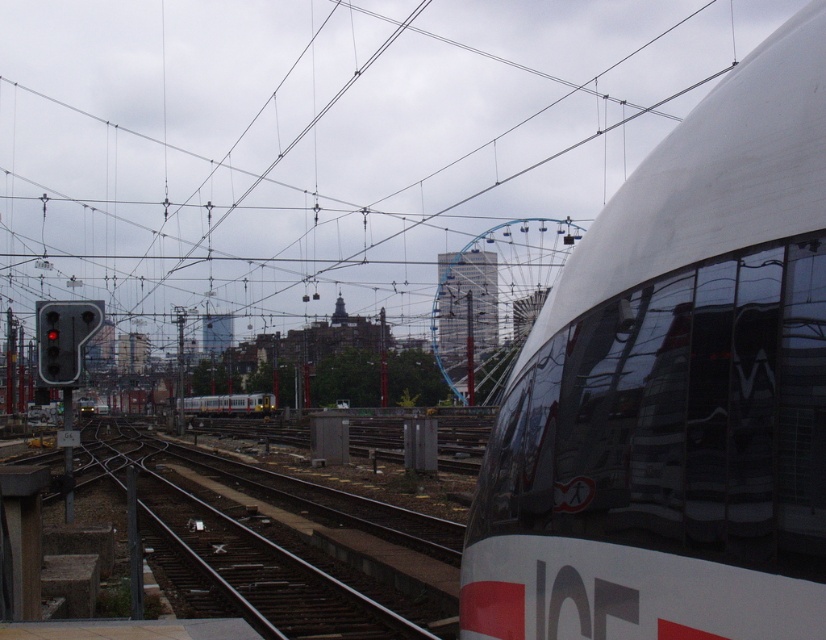
Question: Which of the following is the farthest from the observer?

Choices:
 (A) (397, 230)
 (B) (78, 371)
 (C) (819, 497)

Answer: (A)

Question: Can you confirm if white glossy train at center is wider than silver metallic train at center?

Choices:
 (A) yes
 (B) no

Answer: (B)

Question: Can you confirm if white glossy train at center is positioned below black plastic traffic light at left?

Choices:
 (A) yes
 (B) no

Answer: (B)

Question: Which of the following is the closest to the observer?

Choices:
 (A) 250,404
 (B) 651,307

Answer: (B)

Question: Observing the image, what is the correct spatial positioning of metallic wire at upper center in reference to black plastic traffic light at left?

Choices:
 (A) right
 (B) left

Answer: (B)

Question: Considering the real-world distances, which object is closest to the black plastic traffic light at left?

Choices:
 (A) white glossy train at center
 (B) metallic wire at upper center
 (C) silver metallic train at center

Answer: (A)